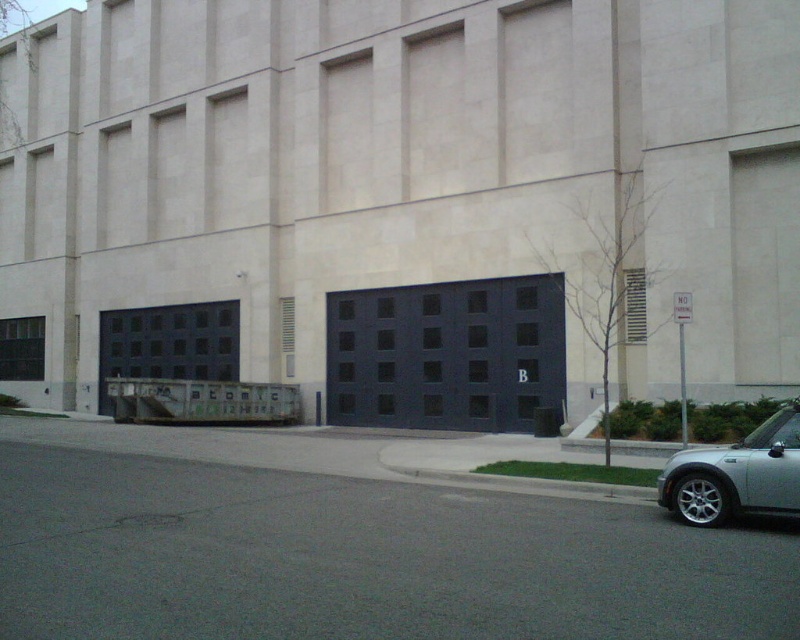
Measure the distance from dark matte garage door at center to silver metallic car at lower right.

dark matte garage door at center is 12.83 meters away from silver metallic car at lower right.

Which is above, dark matte garage door at center or silver metallic car at lower right?

dark matte garage door at center is higher up.

Which is in front, point (562, 388) or point (796, 509)?

Point (796, 509) is more forward.

I want to click on dark matte garage door at center, so click(x=448, y=355).